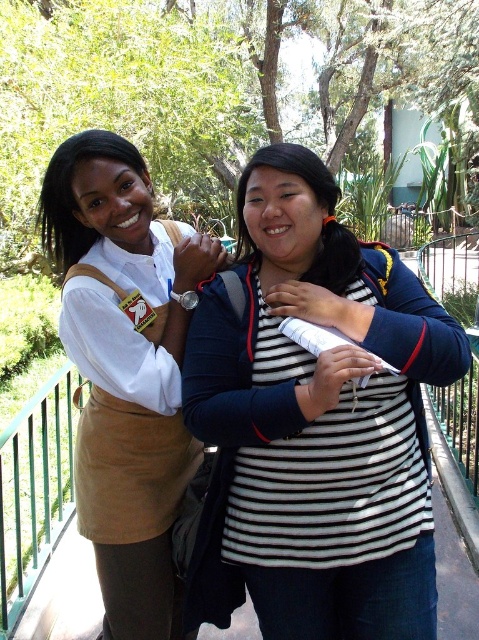
Question: Where is black striped shirt at center located in relation to matte khaki skirt at center in the image?

Choices:
 (A) left
 (B) right

Answer: (B)

Question: Which point is closer to the camera taking this photo?

Choices:
 (A) (97, 445)
 (B) (340, 424)

Answer: (B)

Question: Can you confirm if black striped shirt at center is positioned above matte khaki skirt at center?

Choices:
 (A) yes
 (B) no

Answer: (A)

Question: Which object appears farthest from the camera in this image?

Choices:
 (A) black striped shirt at center
 (B) matte khaki skirt at center

Answer: (B)

Question: Does black striped shirt at center appear over matte khaki skirt at center?

Choices:
 (A) no
 (B) yes

Answer: (B)